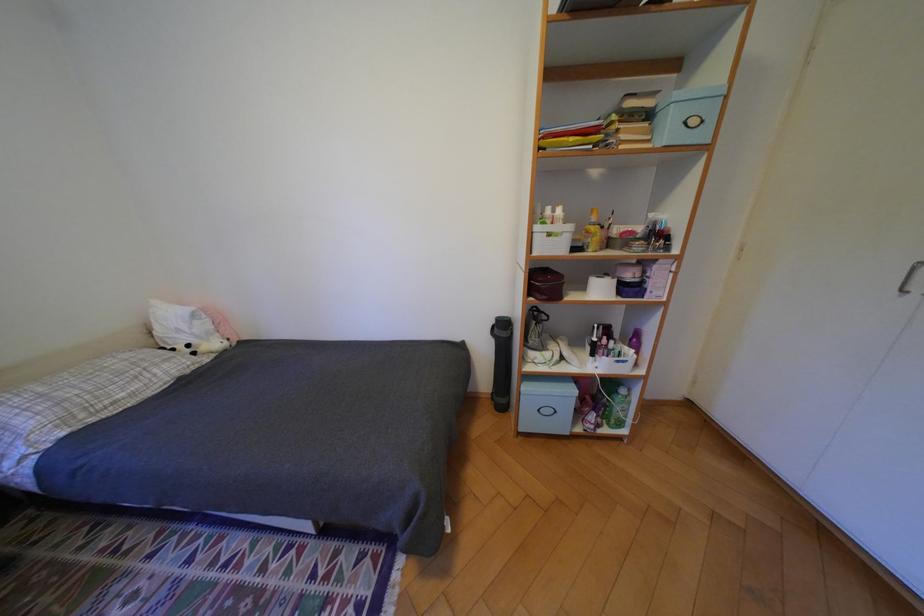
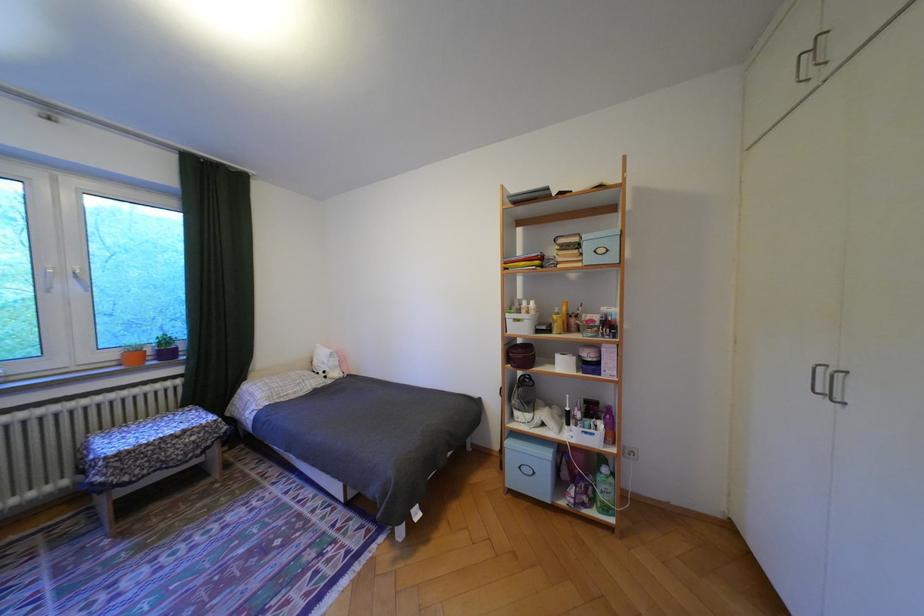
In the second image, find the point that corresponds to the point at 610,426 in the first image.

(596, 505)